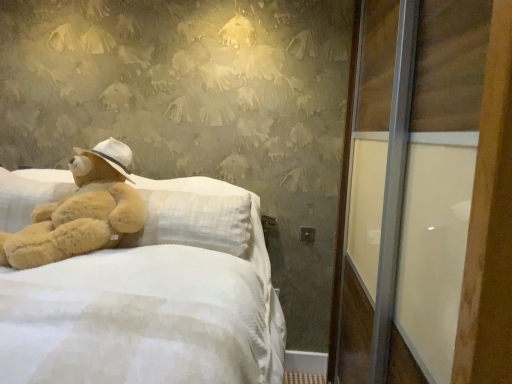
Question: Considering the relative positions of transparent glass screen door at right and soft beige plush at left in the image provided, is transparent glass screen door at right to the left or to the right of soft beige plush at left?

Choices:
 (A) right
 (B) left

Answer: (A)

Question: Which is correct: transparent glass screen door at right is inside soft beige plush at left, or outside of it?

Choices:
 (A) outside
 (B) inside

Answer: (A)

Question: Estimate the real-world distances between objects in this image. Which object is farther from the soft plush bed at left?

Choices:
 (A) soft beige plush at left
 (B) transparent glass screen door at right

Answer: (B)

Question: Which of these objects is positioned farthest from the soft beige plush at left?

Choices:
 (A) soft plush bed at left
 (B) transparent glass screen door at right

Answer: (B)